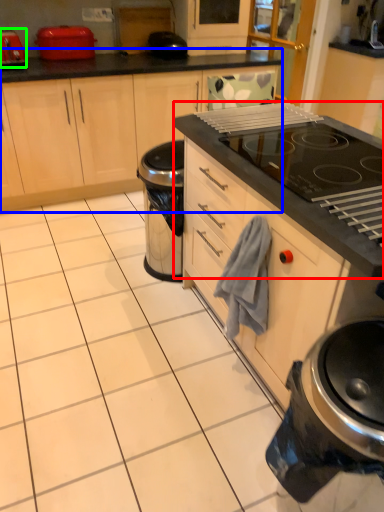
Question: Which object is the farthest from oven (highlighted by a red box)? Choose among these: cabinetry (highlighted by a blue box) or kitchen appliance (highlighted by a green box).

Choices:
 (A) cabinetry
 (B) kitchen appliance

Answer: (B)